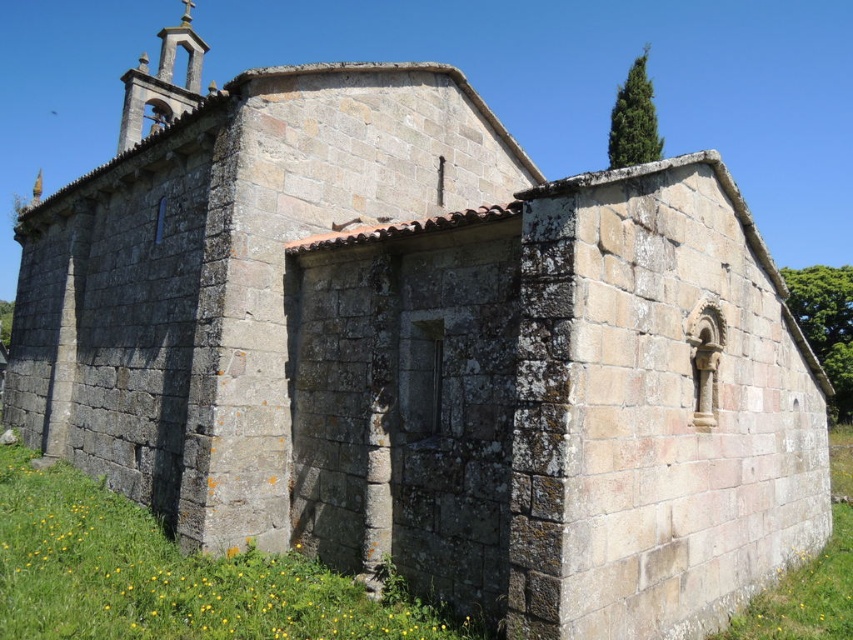
You are a gardener planning to plant flowers in the area near the green mossy stone wall at lower center and the green grass at lower right. Which object is higher up from the ground level?

The green mossy stone wall at lower center is located above the green grass at lower right, so it is higher up from the ground level.

You are standing at point (164, 576) in the historic stone church scene. What do you see immediately around you?

You see the green mossy stone wall at lower center immediately around you at point (164, 576).